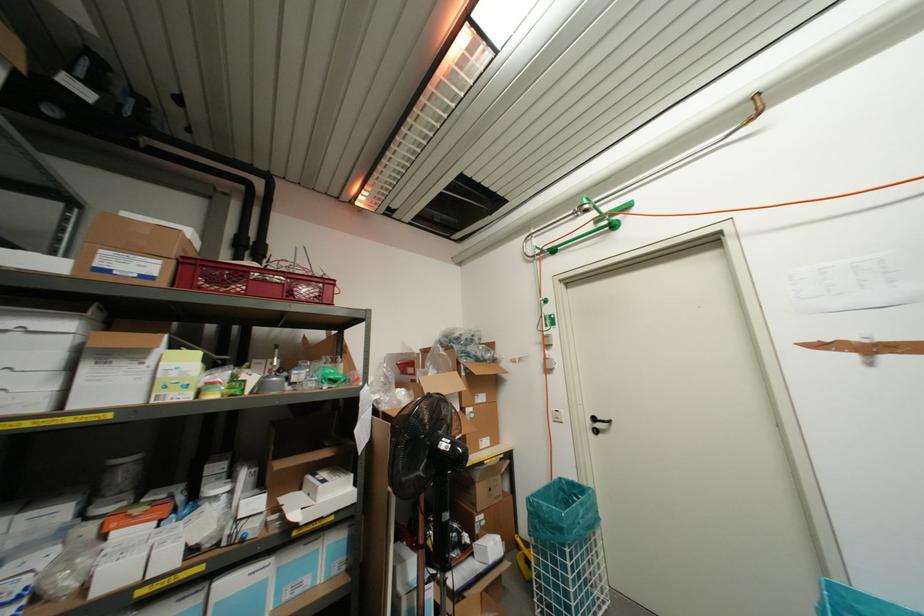
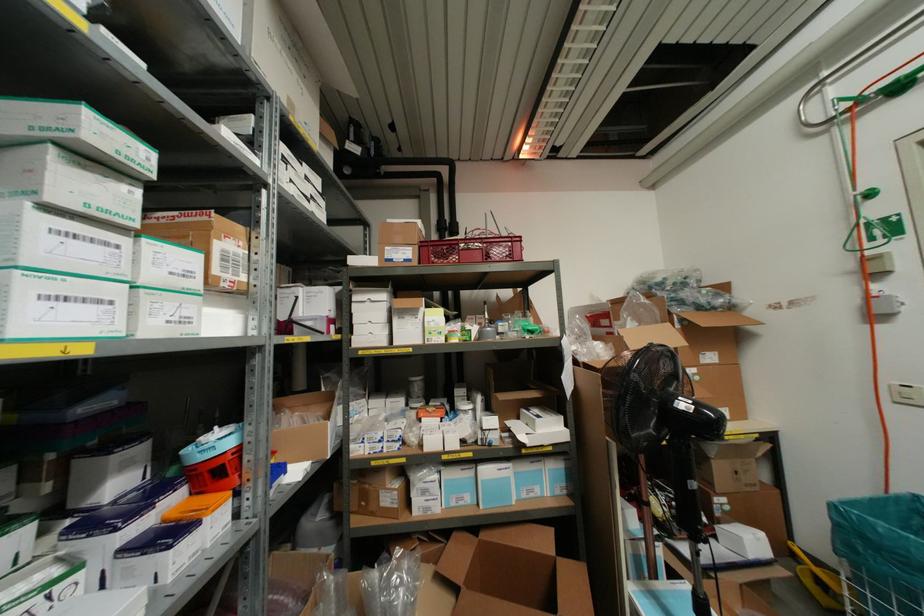
Locate, in the second image, the point that corresponds to (126,214) in the first image.

(388, 220)